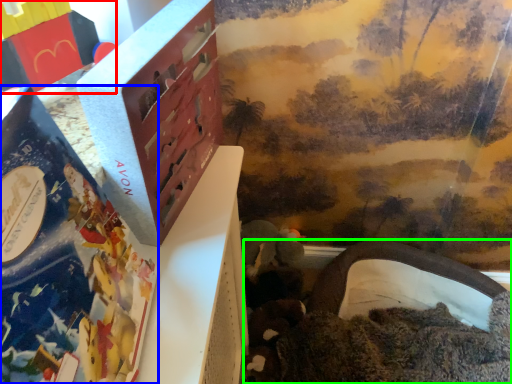
Question: Which is nearer to the toy (highlighted by a red box)? book (highlighted by a blue box) or toy (highlighted by a green box).

Choices:
 (A) book
 (B) toy

Answer: (A)